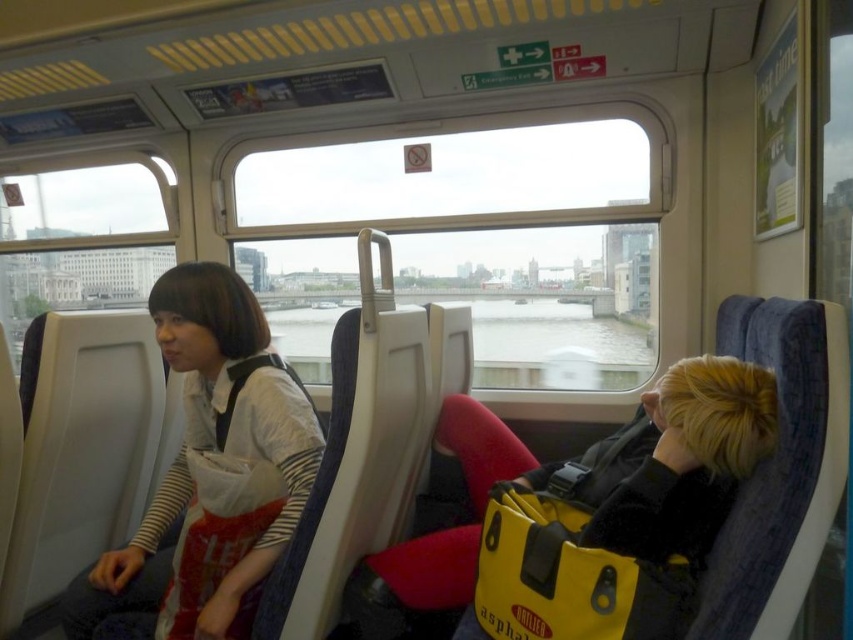
Is yellow waterproof bag at center below white matte shirt at left?

Correct, yellow waterproof bag at center is located below white matte shirt at left.

Who is taller, yellow waterproof bag at center or white matte shirt at left?

With more height is white matte shirt at left.

Does point (583, 612) come closer to viewer compared to point (256, 566)?

That is True.

The image size is (853, 640). In order to click on yellow waterproof bag at center in this screenshot , I will do `click(621, 515)`.